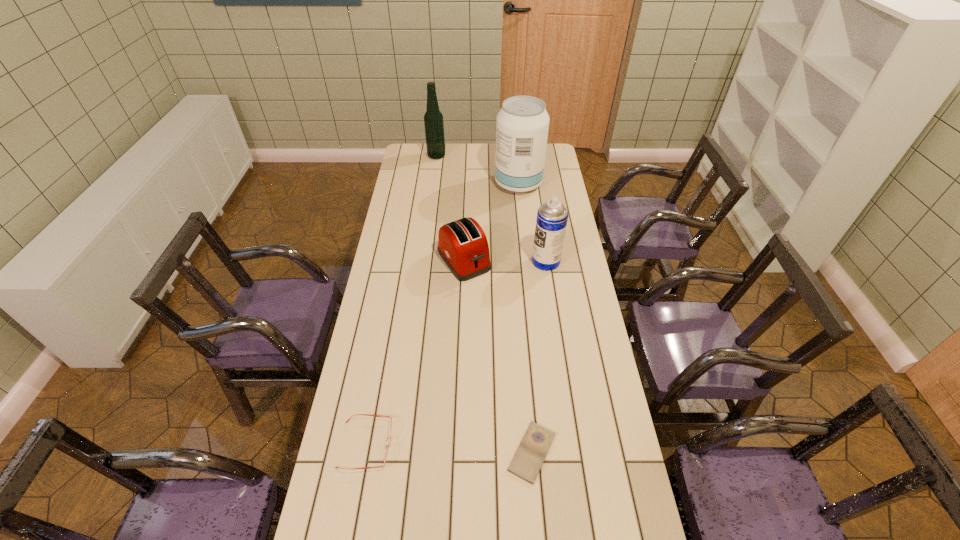
This screenshot has height=540, width=960. In order to click on vacant space that satisfies the following two spatial constraints: 1. on the label side of the third tallest object; 2. on the front side of the shortest object in this screenshot , I will do `click(574, 452)`.

In order to click on vacant area that satisfies the following two spatial constraints: 1. on the back side of the shortest object; 2. on the right side of the nearer alcohol in this screenshot , I will do `click(510, 184)`.